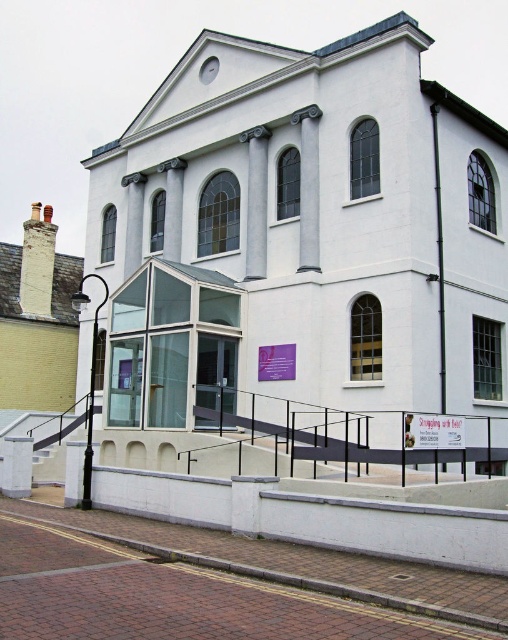
Is point (144, 324) farther from camera compared to point (46, 296)?

No, it is not.

Between point (402, 28) and point (27, 292), which one is positioned behind?

Point (27, 292)

Locate an element on the screen. white smooth chapel at center is located at coordinates (307, 253).

This screenshot has width=508, height=640. Identify the location of white smooth chapel at center. (307, 253).